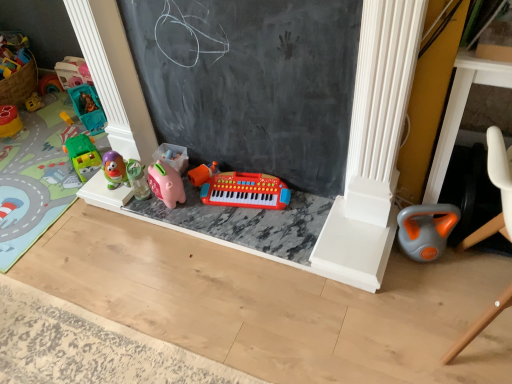
This screenshot has height=384, width=512. What are the coordinates of `vacant space to the left of green plastic car at left, the 5th toy when ordered from right to left` in the screenshot? It's located at (53, 175).